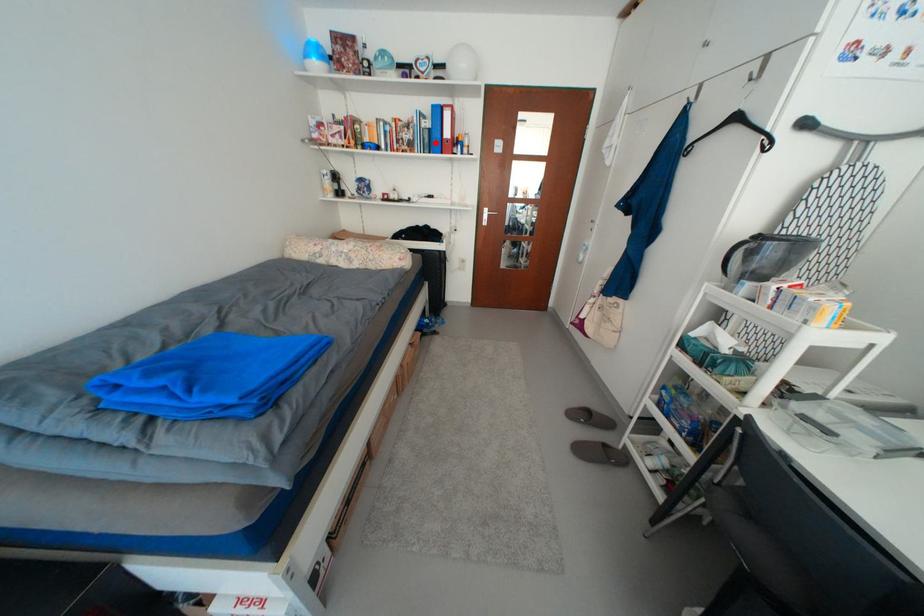
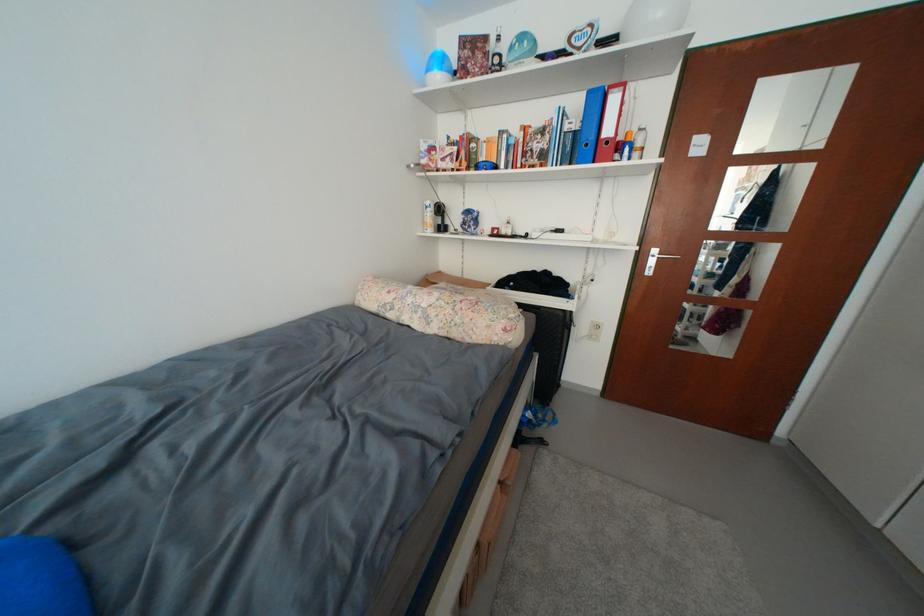
In the second image, find the point that corresponds to the highlighted location in the first image.

(578, 151)